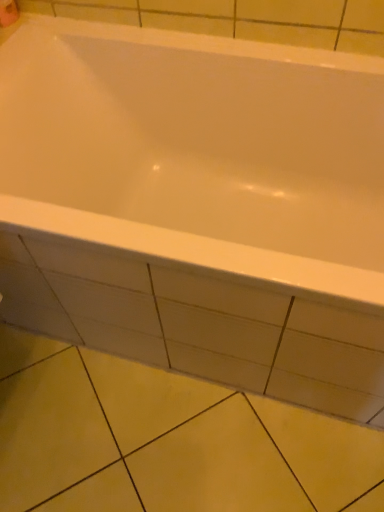
Question: Can you confirm if white paper at upper left is positioned to the left of yellow matte tile at lower center?

Choices:
 (A) no
 (B) yes

Answer: (B)

Question: Is yellow matte tile at lower center completely or partially inside white paper at upper left?

Choices:
 (A) no
 (B) yes

Answer: (A)

Question: From a real-world perspective, is white paper at upper left over yellow matte tile at lower center?

Choices:
 (A) no
 (B) yes

Answer: (B)

Question: Is white paper at upper left far away from yellow matte tile at lower center?

Choices:
 (A) yes
 (B) no

Answer: (A)

Question: Is white paper at upper left placed right next to yellow matte tile at lower center?

Choices:
 (A) yes
 (B) no

Answer: (B)

Question: Can you confirm if white paper at upper left is positioned to the right of yellow matte tile at lower center?

Choices:
 (A) yes
 (B) no

Answer: (B)

Question: Does yellow matte tile at lower center have a smaller size compared to white paper at upper left?

Choices:
 (A) yes
 (B) no

Answer: (B)

Question: Is yellow matte tile at lower center in front of white paper at upper left?

Choices:
 (A) yes
 (B) no

Answer: (A)

Question: From the image's perspective, does yellow matte tile at lower center appear lower than white paper at upper left?

Choices:
 (A) yes
 (B) no

Answer: (A)

Question: From a real-world perspective, is yellow matte tile at lower center positioned over white paper at upper left based on gravity?

Choices:
 (A) no
 (B) yes

Answer: (A)

Question: Does yellow matte tile at lower center come behind white paper at upper left?

Choices:
 (A) no
 (B) yes

Answer: (A)

Question: Is yellow matte tile at lower center thinner than white paper at upper left?

Choices:
 (A) yes
 (B) no

Answer: (B)

Question: Are white paper at upper left and white glossy bathtub at center making contact?

Choices:
 (A) yes
 (B) no

Answer: (B)